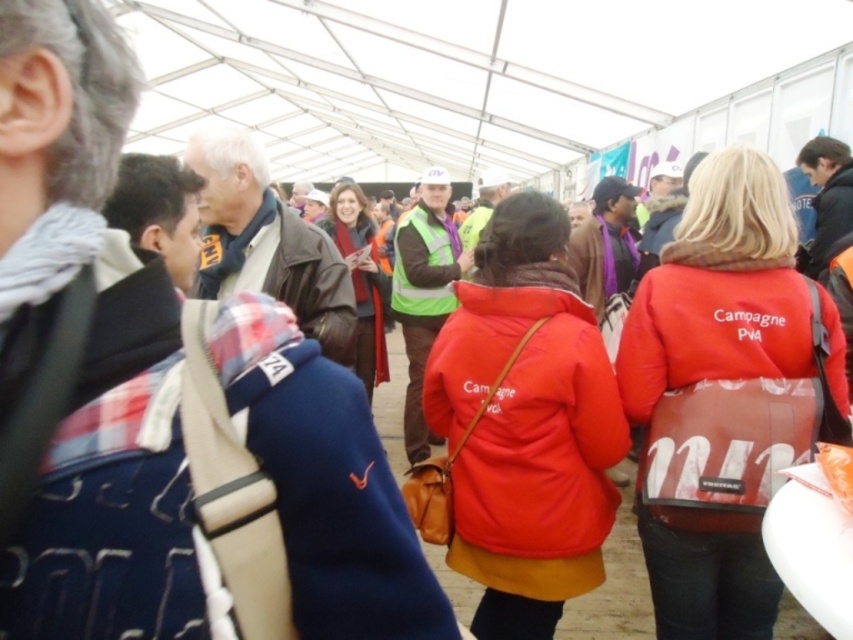
Question: Is matte blue jacket at center smaller than leather jacket at center?

Choices:
 (A) yes
 (B) no

Answer: (A)

Question: Estimate the real-world distances between objects in this image. Which object is farther from the red matte jacket at center?

Choices:
 (A) leather jacket at center
 (B) matte red jacket at center
 (C) matte blue jacket at center

Answer: (C)

Question: Does leather jacket at center have a larger size compared to dark brown leather jacket at center?

Choices:
 (A) no
 (B) yes

Answer: (A)

Question: Does matte blue jacket at center appear on the left side of neon green reflective vest at center?

Choices:
 (A) no
 (B) yes

Answer: (B)

Question: Which object appears closest to the camera in this image?

Choices:
 (A) leather jacket at center
 (B) matte red jacket at center

Answer: (B)

Question: Which object is positioned farthest from the matte red jacket at center?

Choices:
 (A) neon green reflective vest at center
 (B) leather jacket at center

Answer: (A)